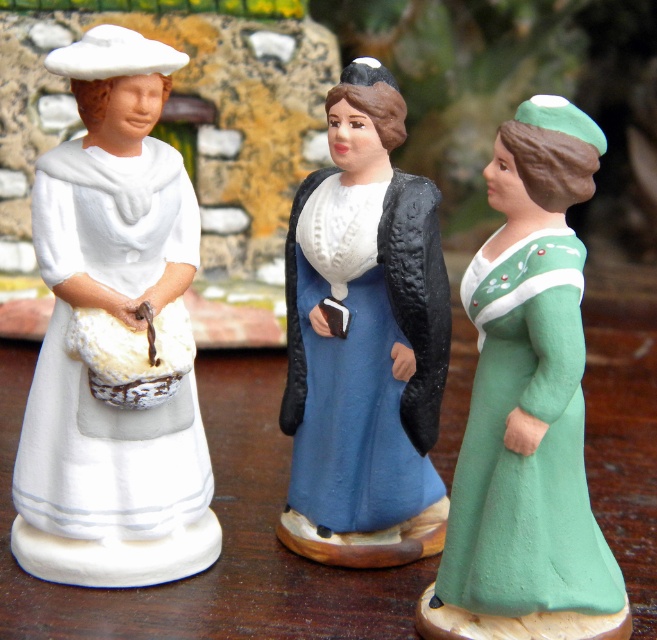
Can you confirm if green matte dress at center is positioned above blue matte dress at center?

No.

Does green matte dress at center have a larger size compared to blue matte dress at center?

Indeed, green matte dress at center has a larger size compared to blue matte dress at center.

Find the location of a particular element. Image resolution: width=657 pixels, height=640 pixels. green matte dress at center is located at coordinates (528, 408).

Where is `green matte dress at center`? Image resolution: width=657 pixels, height=640 pixels. green matte dress at center is located at coordinates (528, 408).

Can you confirm if white matte porcelain figurine at left is positioned below blue matte dress at center?

No, white matte porcelain figurine at left is not below blue matte dress at center.

Measure the distance between white matte porcelain figurine at left and blue matte dress at center.

white matte porcelain figurine at left is 5.09 inches away from blue matte dress at center.

This screenshot has height=640, width=657. In order to click on white matte porcelain figurine at left in this screenshot , I will do `click(114, 339)`.

Who is more forward, (87, 342) or (622, 627)?

Point (622, 627) is more forward.

Which is in front, point (127, 54) or point (535, 442)?

Positioned in front is point (535, 442).

Locate an element on the screen. This screenshot has width=657, height=640. white matte porcelain figurine at left is located at coordinates (114, 339).